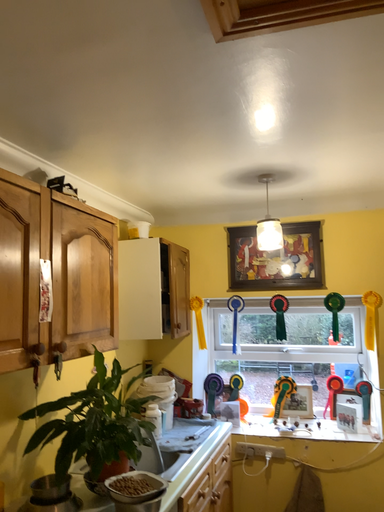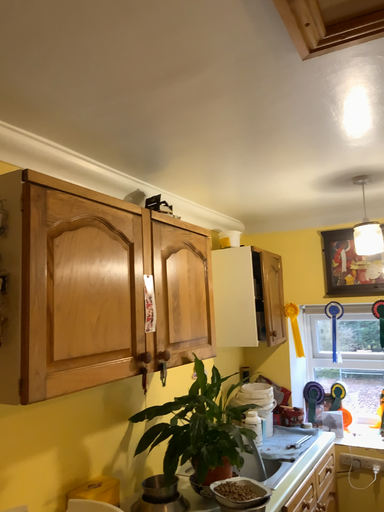
Question: How did the camera likely rotate when shooting the video?

Choices:
 (A) rotated right
 (B) rotated left

Answer: (B)